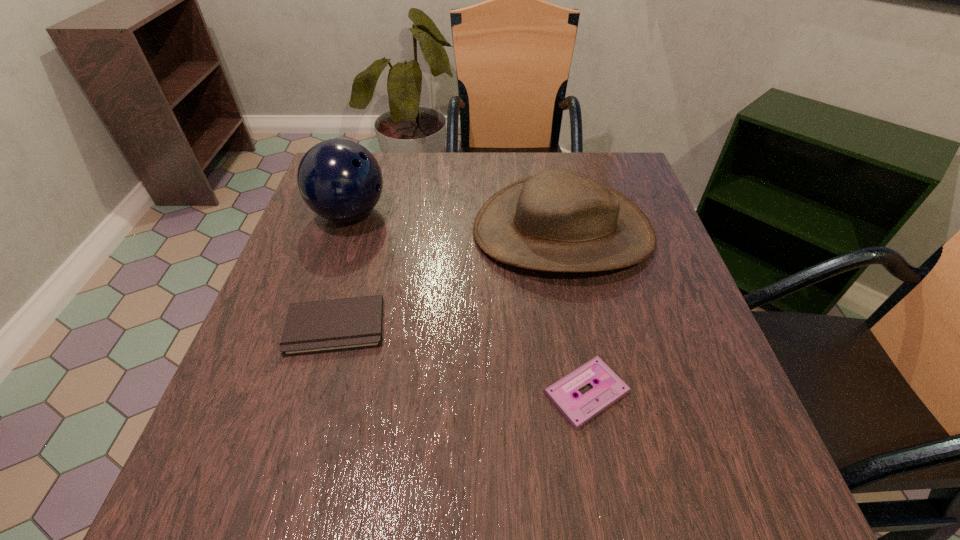
At what (x,y) coordinates should I click in order to perform the action: click on bowling ball that is positioned at the far edge. Please return your answer as a coordinate pair (x, y). Looking at the image, I should click on (340, 180).

This screenshot has width=960, height=540. Identify the location of cowboy hat situated at the far edge. (558, 220).

The image size is (960, 540). What are the coordinates of `bowling ball that is at the left edge` in the screenshot? It's located at (340, 180).

Locate an element on the screen. The image size is (960, 540). checkbook that is at the left edge is located at coordinates click(x=322, y=326).

At what (x,y) coordinates should I click in order to perform the action: click on object positioned at the right edge. Please return your answer as a coordinate pair (x, y). Looking at the image, I should click on (558, 220).

Where is `object at the far left corner`? The width and height of the screenshot is (960, 540). object at the far left corner is located at coordinates (340, 180).

At what (x,y) coordinates should I click in order to perform the action: click on object present at the far right corner. Please return your answer as a coordinate pair (x, y). Image resolution: width=960 pixels, height=540 pixels. Looking at the image, I should click on (558, 220).

The width and height of the screenshot is (960, 540). I want to click on vacant space at the far edge, so click(x=438, y=157).

Where is `vacant space at the near edge of the desktop`? This screenshot has width=960, height=540. vacant space at the near edge of the desktop is located at coordinates (401, 450).

This screenshot has width=960, height=540. I want to click on vacant space at the left edge of the desktop, so click(x=298, y=263).